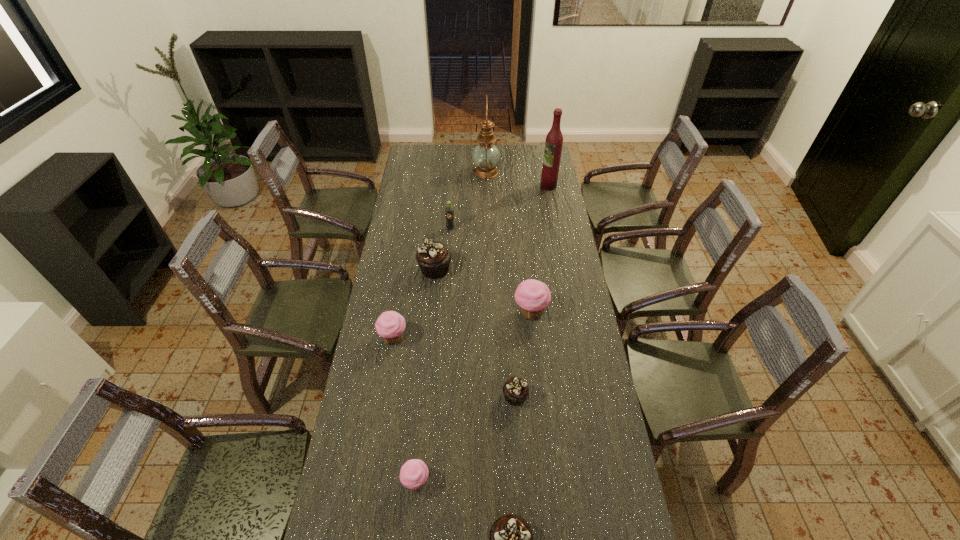
In order to click on vacant space located 0.050m on the back of the leftmost brown cupcake in this screenshot , I will do `click(437, 250)`.

Identify the location of free space located on the front of the farthest pink cupcake. (541, 422).

Find the location of `vacant position located on the right of the leftmost cupcake`. vacant position located on the right of the leftmost cupcake is located at coordinates (463, 338).

Locate an element on the screen. free space located 0.280m on the front of the third nearest cupcake is located at coordinates (521, 502).

The width and height of the screenshot is (960, 540). I want to click on free space located 0.090m on the back of the second pink cupcake from right to left, so [x=420, y=438].

Find the location of a particular element. Image resolution: width=960 pixels, height=540 pixels. object that is positioned at the far edge is located at coordinates (485, 155).

This screenshot has width=960, height=540. Find the location of `liquor that is positioned at the right edge`. liquor that is positioned at the right edge is located at coordinates (554, 140).

I want to click on cupcake that is at the right edge, so click(533, 296).

Locate an element on the screen. This screenshot has width=960, height=540. free spot at the far edge of the desktop is located at coordinates (513, 152).

Locate an element on the screen. Image resolution: width=960 pixels, height=540 pixels. vacant space at the left edge of the desktop is located at coordinates (386, 287).